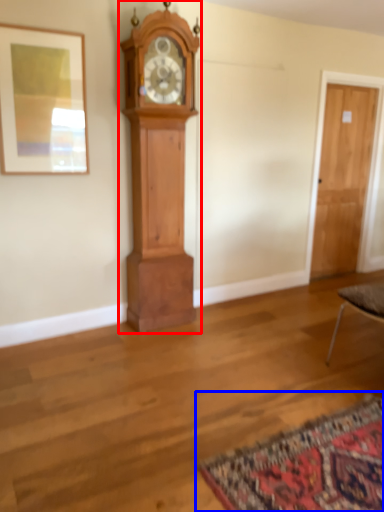
Question: Which point is further to the camera, wall clock (highlighted by a red box) or mat (highlighted by a blue box)?

Choices:
 (A) wall clock
 (B) mat

Answer: (A)